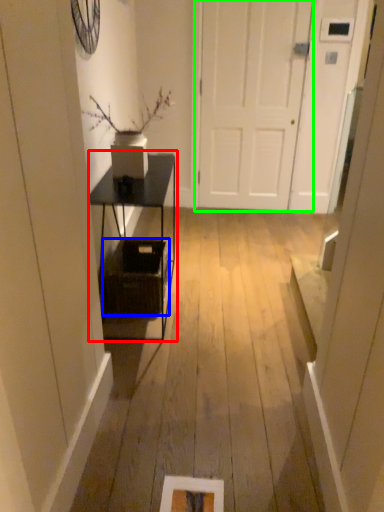
Question: Which object is positioned closest to table (highlighted by a red box)? Select from basket (highlighted by a blue box) and door (highlighted by a green box).

Choices:
 (A) basket
 (B) door

Answer: (A)